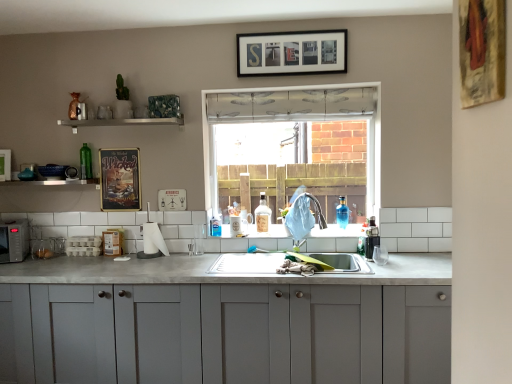
This screenshot has height=384, width=512. Find the location of `empty space that is ontop of black matte picture frame at upper center, positioned as the 2th picture frame in back-to-front order (from a real-world perspective)`. empty space that is ontop of black matte picture frame at upper center, positioned as the 2th picture frame in back-to-front order (from a real-world perspective) is located at coordinates (288, 26).